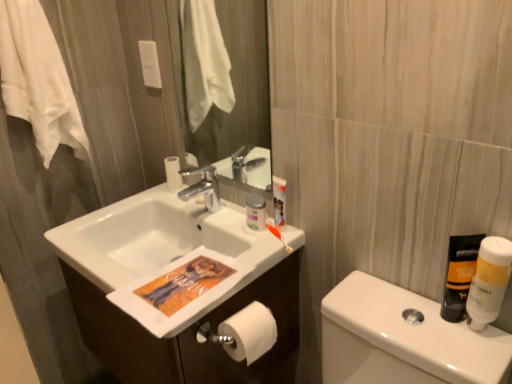
Where is `vacant region above white glossy toilet paper at lower left (from a real-world perspective)`? The image size is (512, 384). vacant region above white glossy toilet paper at lower left (from a real-world perspective) is located at coordinates (404, 322).